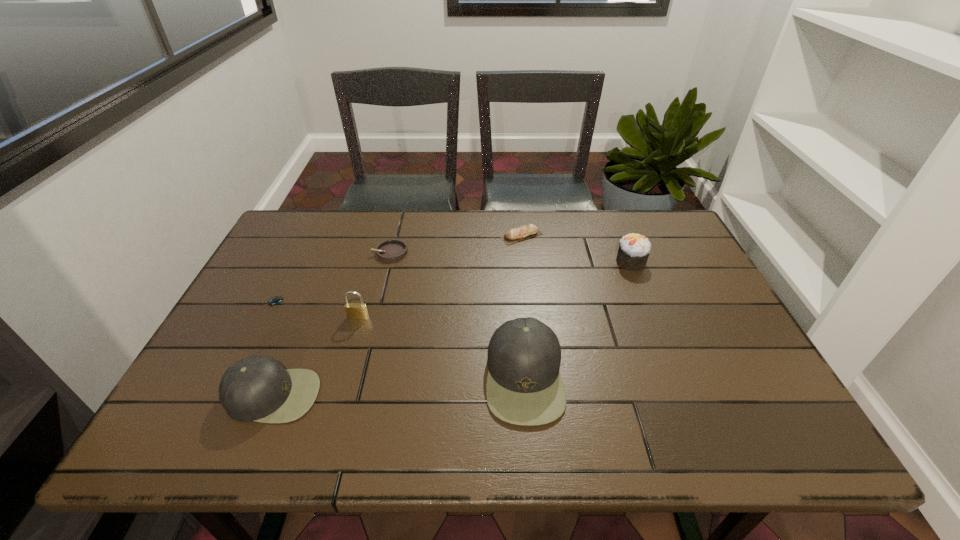
Locate an element on the screen. empty space that is in between the padlock and the second shortest object is located at coordinates (374, 285).

Where is `vacant area that lies between the cupcake and the left cap`? Image resolution: width=960 pixels, height=540 pixels. vacant area that lies between the cupcake and the left cap is located at coordinates (452, 328).

At what (x,y) coordinates should I click in order to perform the action: click on empty space between the left cap and the fourth farthest object. Please return your answer as a coordinate pair (x, y). Looking at the image, I should click on (270, 349).

The width and height of the screenshot is (960, 540). I want to click on vacant space that is in between the rightmost object and the left cap, so click(x=452, y=328).

The height and width of the screenshot is (540, 960). In order to click on free spot between the taller cap and the shortest object in this screenshot , I will do `click(396, 341)`.

Locate an element on the screen. Image resolution: width=960 pixels, height=540 pixels. vacant area that lies between the cupcake and the third shortest object is located at coordinates (576, 248).

The height and width of the screenshot is (540, 960). Find the location of `unoccupied position between the fifth tallest object and the ashtray`. unoccupied position between the fifth tallest object and the ashtray is located at coordinates (456, 244).

Image resolution: width=960 pixels, height=540 pixels. In order to click on vacant area that lies between the left cap and the fourth nearest object in this screenshot , I will do `click(270, 349)`.

Identify the location of vacant region between the rightmost object and the tallest object. The width and height of the screenshot is (960, 540). (578, 320).

Locate an element on the screen. Image resolution: width=960 pixels, height=540 pixels. free spot between the pita bread and the taller cap is located at coordinates (523, 306).